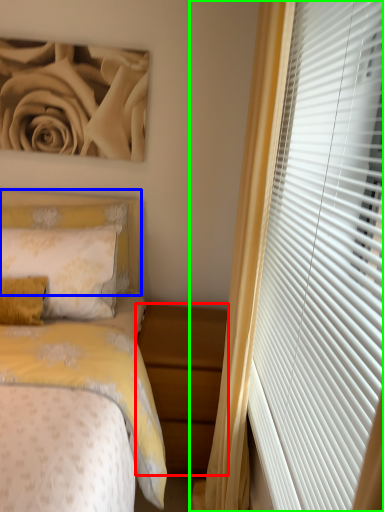
Question: Estimate the real-world distances between objects in this image. Which object is farther from nightstand (highlighted by a red box), headboard (highlighted by a blue box) or curtain (highlighted by a green box)?

Choices:
 (A) headboard
 (B) curtain

Answer: (A)